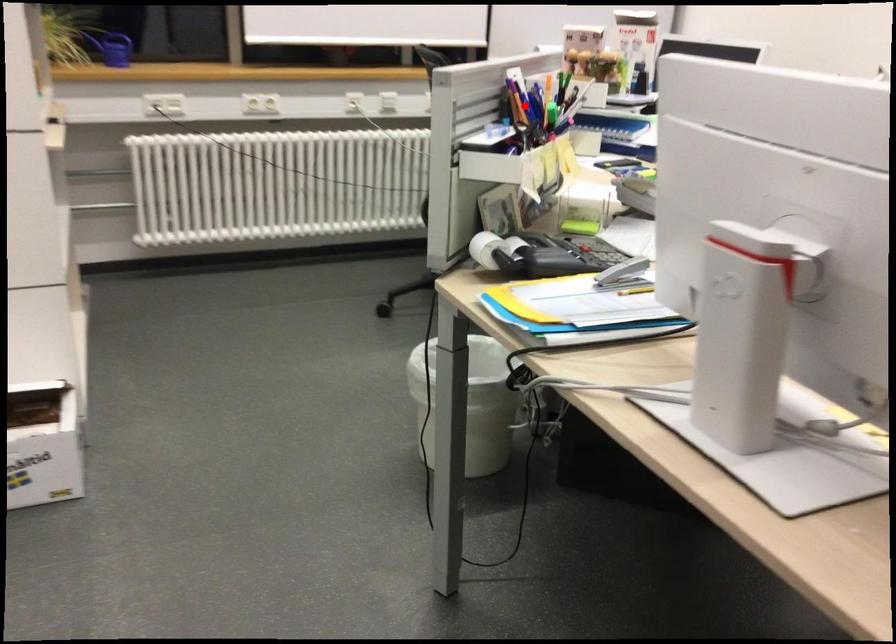
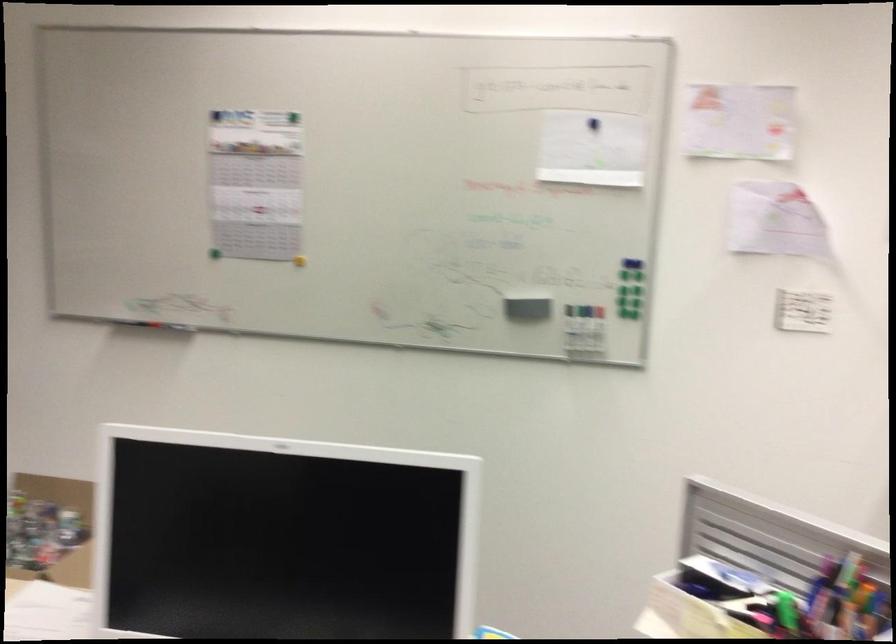
Question: I am providing you with two images of the same scene from different viewpoints. Image1 has a red point marked. In image2, the corresponding 3D location appears at what relative position? Reply with the corresponding letter.

Choices:
 (A) Closer
 (B) Farther

Answer: (A)